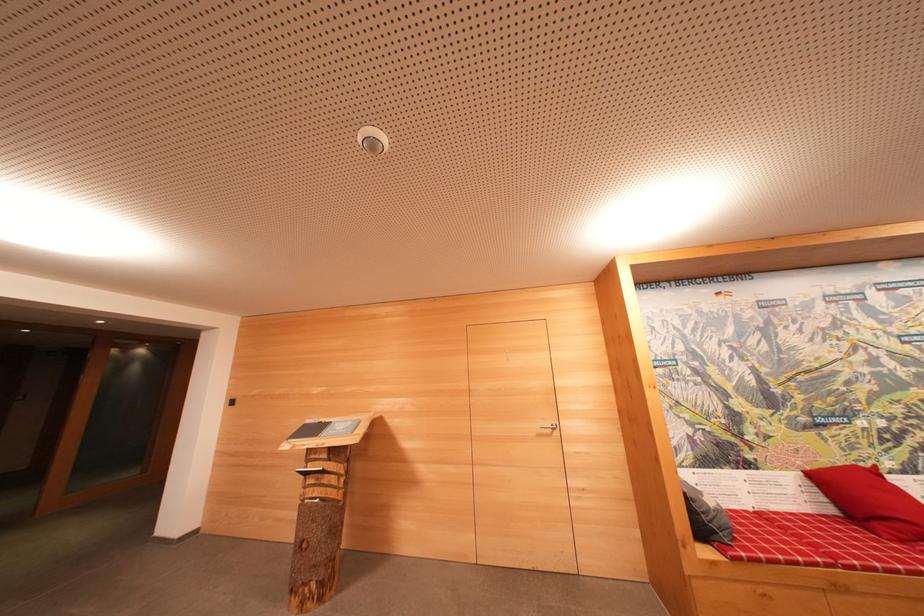
Identify the location of small booklet. This screenshot has height=616, width=924. (309, 430).